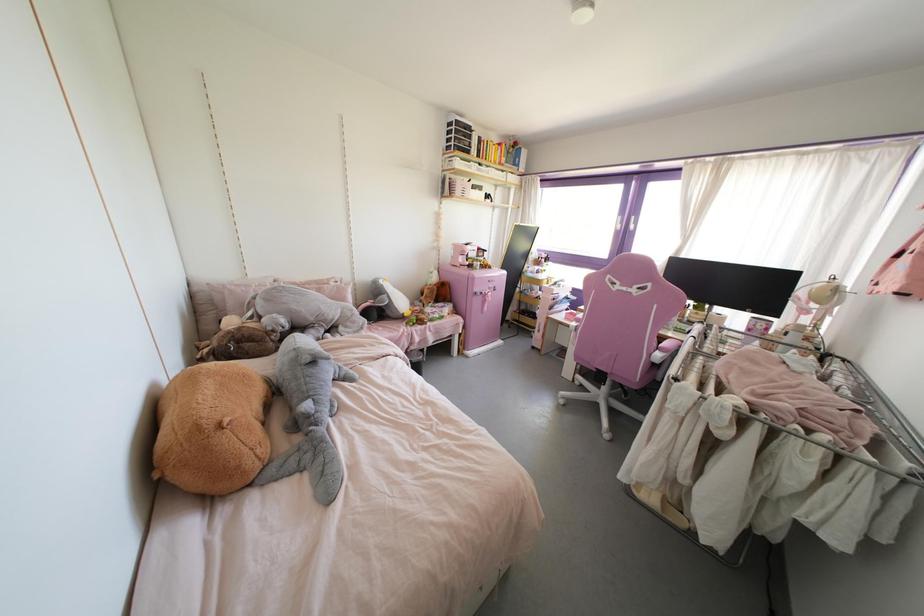
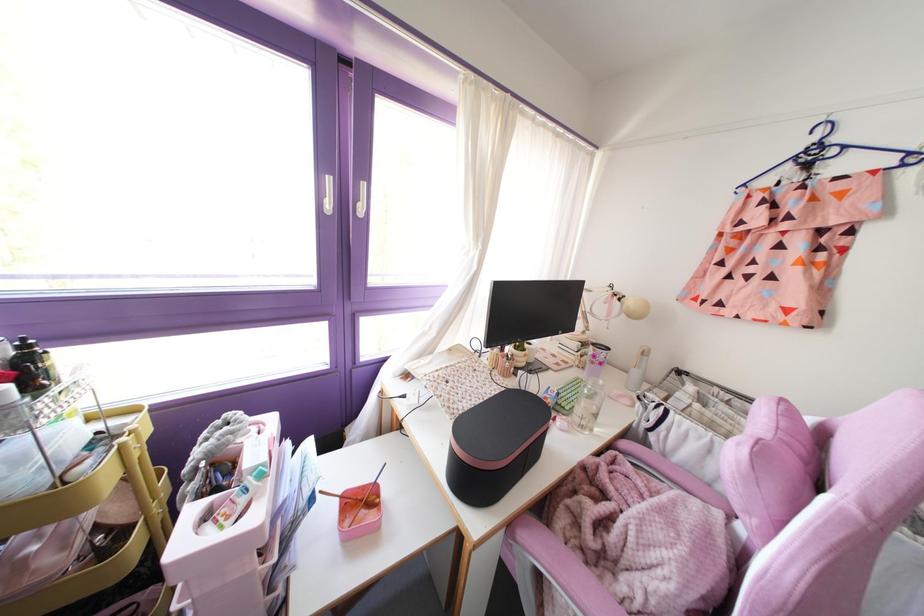
The point at (x=558, y=285) is marked in the first image. Where is the corresponding point in the second image?

(261, 475)